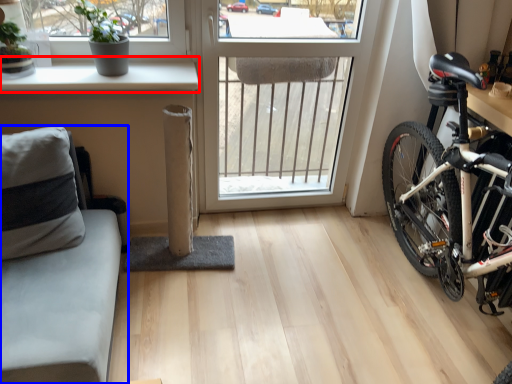
Question: Among these objects, which one is nearest to the camera, window sill (highlighted by a red box) or studio couch (highlighted by a blue box)?

Choices:
 (A) window sill
 (B) studio couch

Answer: (B)